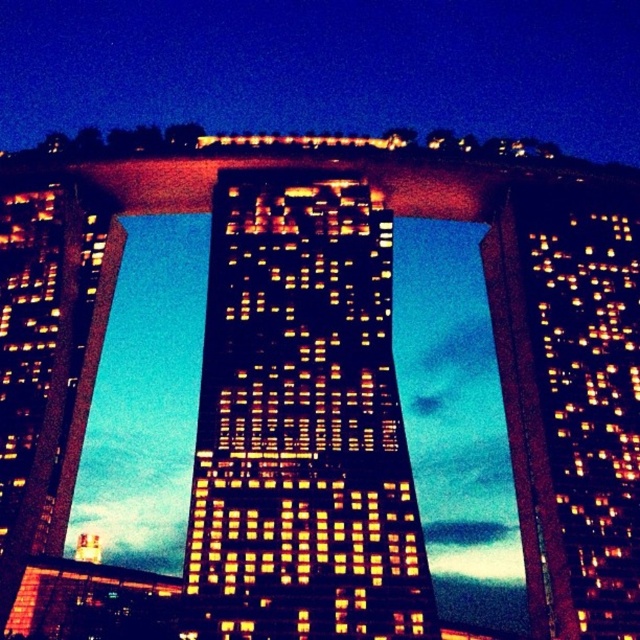
You are standing in front of the central matte glass skyscraper at center and want to walk towards the matte glass tower at left. Which direction should you face to move towards it?

You should face towards the left direction to move towards the matte glass tower at left since it is located to the left side of the matte glass skyscraper at center.

You are standing at the base of the central building and want to locate the point at coordinates (301,422). Based on the description, where would this point be located on the matte glass skyscraper at center?

The point at (301,422) is located on the matte glass skyscraper at center.